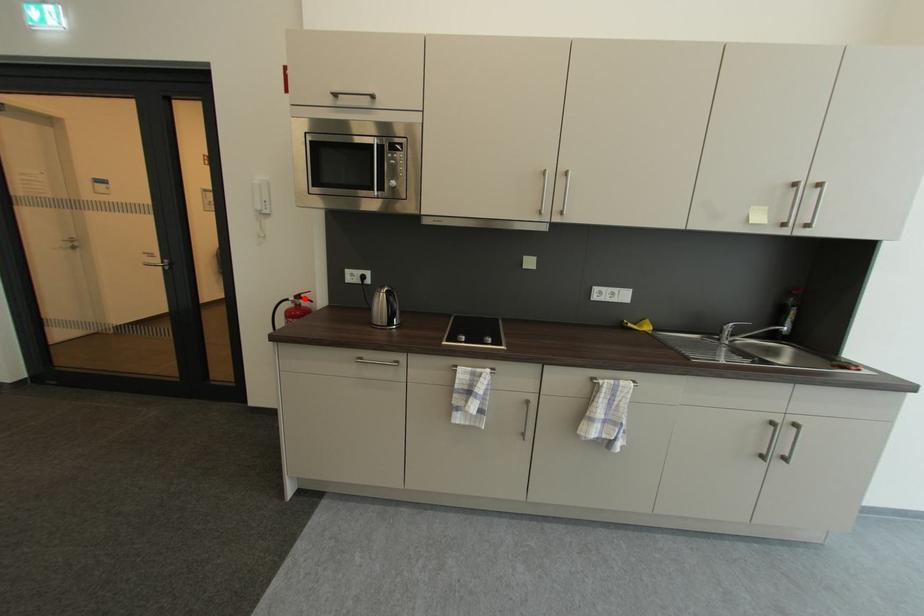
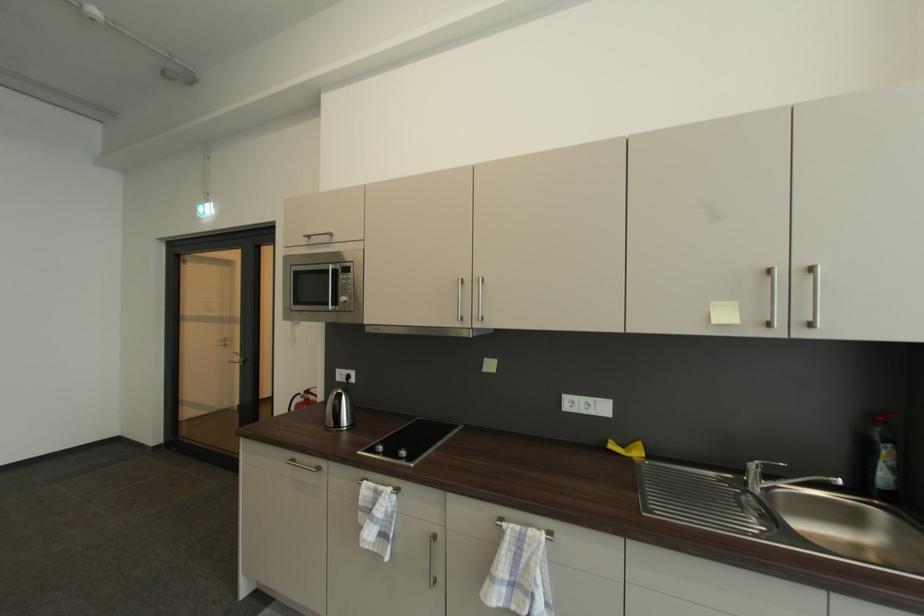
Question: I am providing you with two images of the same scene from different viewpoints. Image1 has a red point marked. In image2, the corresponding 3D location appears at what relative position? Reply with the corresponding letter.

Choices:
 (A) Closer
 (B) Farther

Answer: (B)